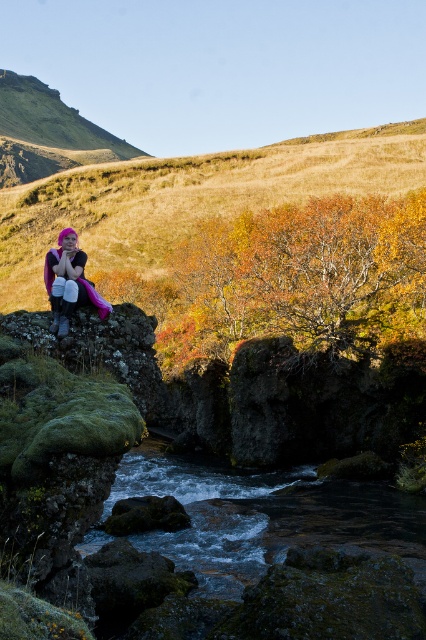
You are an outdoor photographer planning to capture the pink fabric at left and the dark gray rocky stream at center in a single shot. Which object will occupy more space in your photo?

The dark gray rocky stream at center is bigger than the pink fabric at left, so it will occupy more space in the photo.

You are standing in the landscape and want to cross the dark gray rocky stream at center to reach the pink fabric at left. Is the stream between you and the pink fabric?

Yes, the dark gray rocky stream at center is closer to the viewer than the pink fabric at left, so the stream is between you and the pink fabric.

Looking at this image, you are standing at the point labeled point [334,515] and want to walk to the point labeled point [48,266]. Given that the stream flows from right to left, which direction should you move relative to the stream flow to reach your destination?

Since point [334,515] is closer to you than point [48,266], you should move towards the stream flow direction to reach your destination.